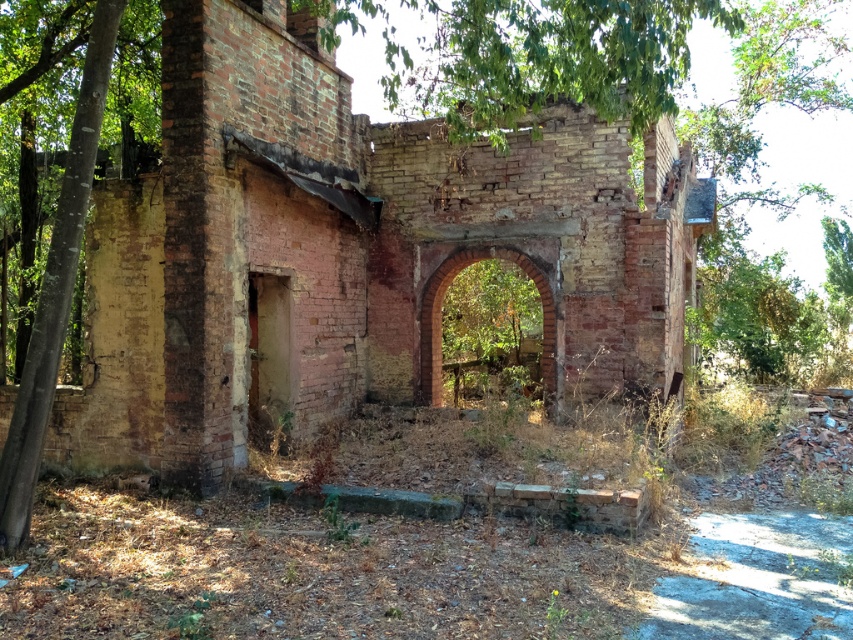
Question: Which of the following is the farthest from the observer?

Choices:
 (A) rusty brick ruins at center
 (B) red brick archway at center

Answer: (B)

Question: Is rusty brick ruins at center to the right of red brick archway at center from the viewer's perspective?

Choices:
 (A) no
 (B) yes

Answer: (A)

Question: Is rusty brick ruins at center to the left of red brick archway at center from the viewer's perspective?

Choices:
 (A) yes
 (B) no

Answer: (A)

Question: Which object is closer to the camera taking this photo?

Choices:
 (A) red brick archway at center
 (B) rusty brick ruins at center

Answer: (B)

Question: Can you confirm if rusty brick ruins at center is positioned above red brick archway at center?

Choices:
 (A) yes
 (B) no

Answer: (A)